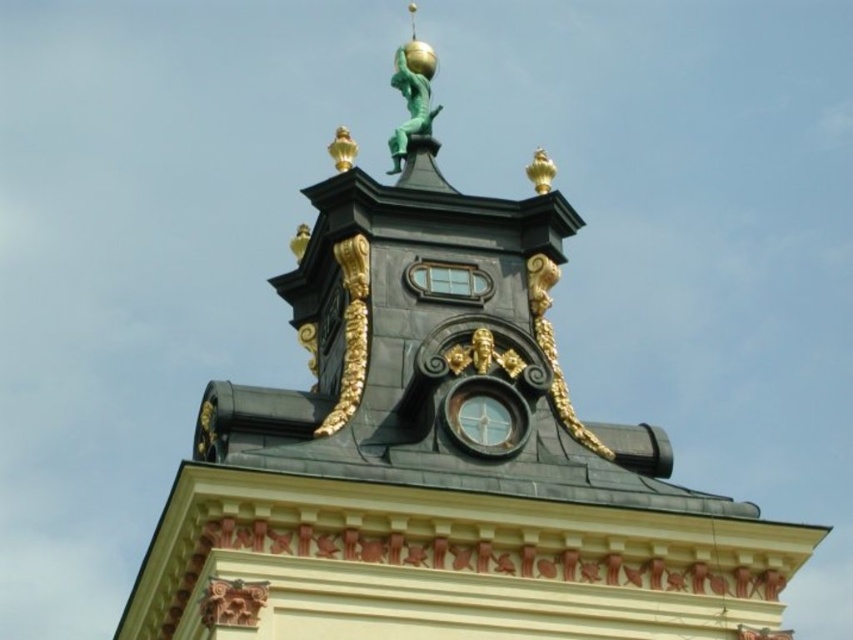
From the picture: You are an architect inspecting this building detail. You notice the gold metallic ornament at upper center and the green patina figure at top. Which of these two objects is smaller in size?

The gold metallic ornament at upper center is smaller in size compared to the green patina figure at top according to the description.

Based on the photo, you are an architect examining this building detail. You need to place a new decorative element between the matte black clock at center and the green patina figure at top. Based on their positions, which direction should you move from the clock to reach the figure?

The green patina figure at top is to the left of the matte black clock at center, so you should move to the left from the clock to reach the figure.

You are an architect examining the building details. You notice the matte black clock at center and the gold metallic ornament at upper center. Which object is located to the right of the other?

The matte black clock at center is positioned on the right side of gold metallic ornament at upper center.